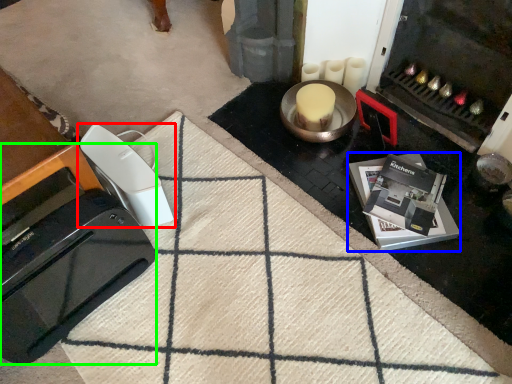
Question: Based on their relative distances, which object is nearer to home appliance (highlighted by a red box)? Choose from appliance (highlighted by a blue box) and home appliance (highlighted by a green box).

Choices:
 (A) appliance
 (B) home appliance

Answer: (B)